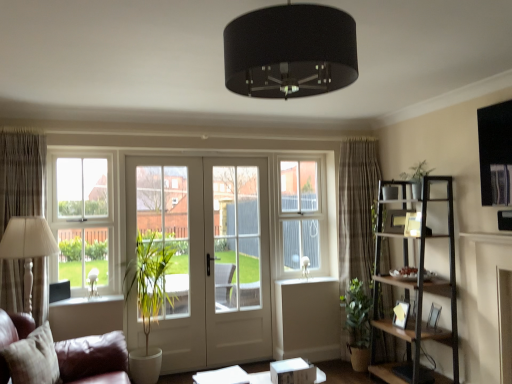
Question: From the image's perspective, is white plastic window screen at center beneath wooden picture frame at right, the 2th picture frame when ordered from bottom to top?

Choices:
 (A) no
 (B) yes

Answer: (A)

Question: Is white plastic window screen at center beside wooden picture frame at right, the 2th picture frame positioned from the top?

Choices:
 (A) no
 (B) yes

Answer: (A)

Question: Would you say wooden picture frame at right, the 2th picture frame when ordered from bottom to top, is part of white plastic window screen at center's contents?

Choices:
 (A) yes
 (B) no

Answer: (B)

Question: Can you confirm if white plastic window screen at center is smaller than wooden picture frame at right, the 2th picture frame when ordered from bottom to top?

Choices:
 (A) no
 (B) yes

Answer: (A)

Question: Is white plastic window screen at center in front of wooden picture frame at right, the 2th picture frame when ordered from bottom to top?

Choices:
 (A) no
 (B) yes

Answer: (A)

Question: Considering the positions of dark brown wooden shelf at right and white glossy window sill at center in the image, is dark brown wooden shelf at right wider or thinner than white glossy window sill at center?

Choices:
 (A) thin
 (B) wide

Answer: (B)

Question: From a real-world perspective, is dark brown wooden shelf at right physically located above or below white glossy window sill at center?

Choices:
 (A) above
 (B) below

Answer: (A)

Question: Based on their sizes in the image, would you say dark brown wooden shelf at right is bigger or smaller than white glossy window sill at center?

Choices:
 (A) big
 (B) small

Answer: (A)

Question: Is point (451, 296) closer or farther from the camera than point (302, 279)?

Choices:
 (A) farther
 (B) closer

Answer: (B)

Question: Is beige textured curtain at left, the first curtain when ordered from front to back, taller or shorter than black fabric lampshade at center?

Choices:
 (A) tall
 (B) short

Answer: (A)

Question: From the image's perspective, is beige textured curtain at left, the 2th curtain viewed from the right, located above or below black fabric lampshade at center?

Choices:
 (A) above
 (B) below

Answer: (B)

Question: Is beige textured curtain at left, the first curtain when ordered from front to back, in front of or behind black fabric lampshade at center in the image?

Choices:
 (A) front
 (B) behind

Answer: (B)

Question: Does point (5, 278) appear closer or farther from the camera than point (345, 29)?

Choices:
 (A) closer
 (B) farther

Answer: (B)

Question: Choose the correct answer: Is wooden picture frame at right, the 2th picture frame positioned from the top, inside white plastic window screen at center or outside it?

Choices:
 (A) inside
 (B) outside

Answer: (B)

Question: Considering their positions, is wooden picture frame at right, the 2th picture frame positioned from the top, located in front of or behind white plastic window screen at center?

Choices:
 (A) front
 (B) behind

Answer: (A)